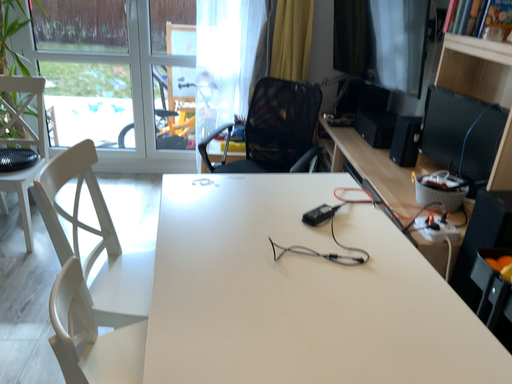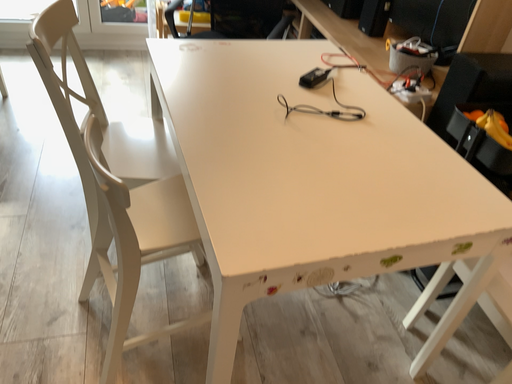
Question: How did the camera likely rotate when shooting the video?

Choices:
 (A) rotated upward
 (B) rotated downward

Answer: (B)